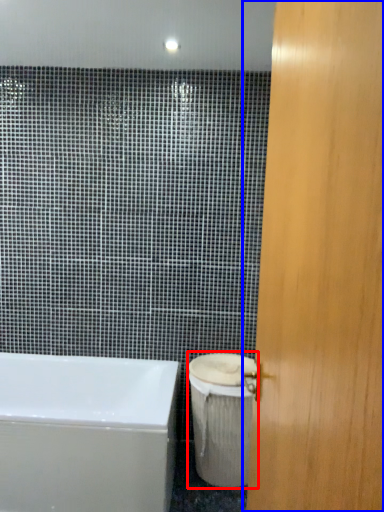
Question: Which object appears closest to the camera in this image, toilet bowl (highlighted by a red box) or door (highlighted by a blue box)?

Choices:
 (A) toilet bowl
 (B) door

Answer: (B)